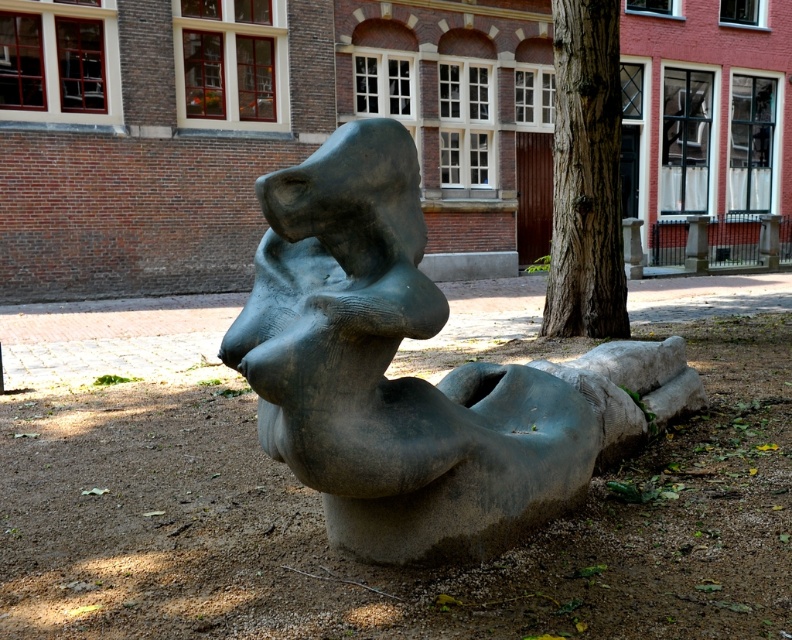
You are a gardener planning to place a new bench in the courtyard. The bench requires a space that is taller than the matte gray stone sculpture at center but shorter than the smooth brown tree trunk at center. Is there enough vertical space between them to place the bench?

The matte gray stone sculpture at center is shorter than the smooth brown tree trunk at center. Therefore, there is enough vertical space between them to place the bench as the required height falls between their heights.

You are a landscape architect designing a garden path that needs to pass between the matte gray stone sculpture at center and the smooth brown tree trunk at center. The path must be wide enough for a wheelchair to pass comfortably. Knowing that standard wheelchair width is 60 cm, can you determine if the space between the two objects is sufficient?

The matte gray stone sculpture at center is larger in size than the smooth brown tree trunk at center, but the exact distance between them isn not specified. Without knowing the actual spacing, it is impossible to determine if the path will be wide enough for a wheelchair.

In the scene shown: You are an artist planning to paint this scene. You want to ensure the matte gray stone sculpture at center and the smooth brown tree trunk at center are accurately placed. Based on the image, which object is located to the left of the other?

The matte gray stone sculpture at center is positioned on the left side of smooth brown tree trunk at center.